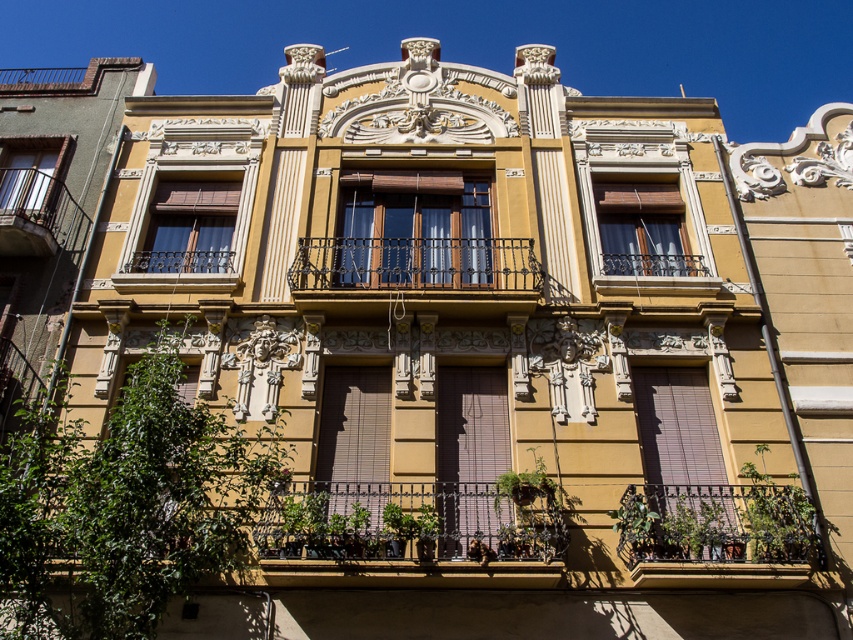
Question: Can you confirm if metallic wrought iron balcony at center is bigger than metallic wrought iron balcony at left?

Choices:
 (A) no
 (B) yes

Answer: (B)

Question: Which object is positioned farthest from the wooden/textured window at upper center?

Choices:
 (A) ironwork balcony at center
 (B) metallic wrought iron balcony at left
 (C) matte brown wood window at left

Answer: (B)

Question: Which object appears closest to the camera in this image?

Choices:
 (A) wooden/textured window at upper center
 (B) ironwork balcony at center
 (C) matte brown wood window at center
 (D) metallic wrought iron balcony at center

Answer: (D)

Question: Is matte brown wood window at center above matte brown wood window at left?

Choices:
 (A) no
 (B) yes

Answer: (A)

Question: Which is farther from the ironwork balcony at center?

Choices:
 (A) matte white curtain at left
 (B) wooden/textured window at upper center
 (C) matte brown wood window at left
 (D) metallic wrought iron balcony at center

Answer: (A)

Question: Does rustic wrought iron balcony at lower right lie behind matte brown wood window at center?

Choices:
 (A) no
 (B) yes

Answer: (A)